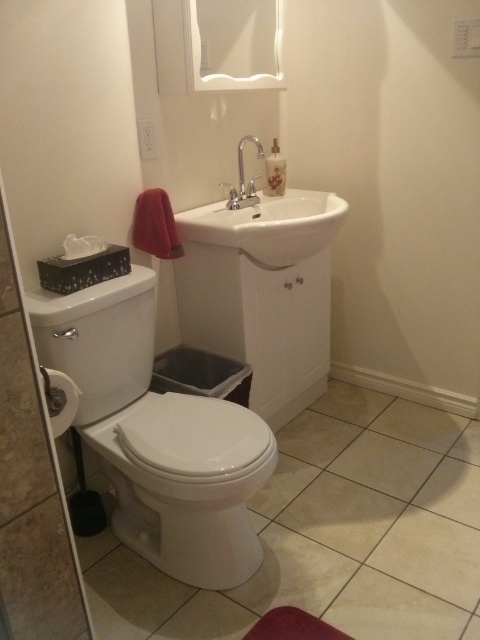
You are standing in the bathroom and want to place a small decorative plant between the two points marked as point (149, 416) and point (48, 595). Which point should the plant be closer to in order to be closer to the camera?

The plant should be closer to point (149, 416) because it is further to the camera than point (48, 595).

You are standing in the bathroom and want to place a new decorative plant pot at the exact center of the bathroom. Given the white glossy toilet at lower left is located at point 0.680, 0.327, where should you place the plant pot?

The exact center of the bathroom would be at point (240, 320). Since the white glossy toilet at lower left is at (156, 435), you should move the plant pot towards the opposite direction to reach the center point.